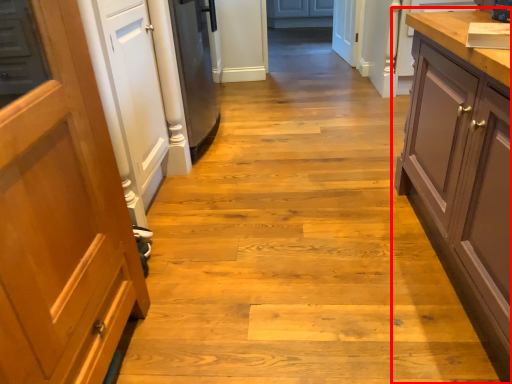
Question: From the image's perspective, where is cabinetry (annotated by the red box) located in relation to countertop in the image?

Choices:
 (A) below
 (B) above

Answer: (A)